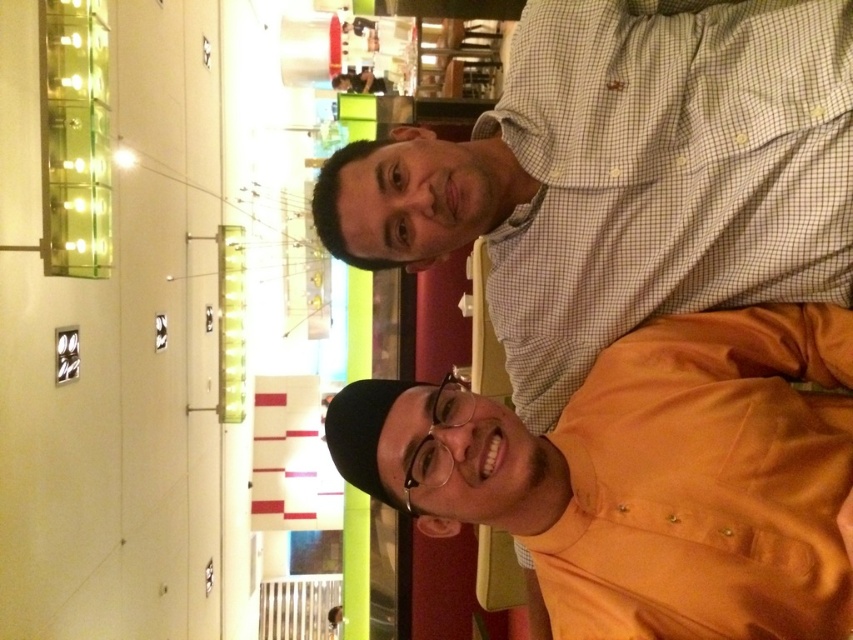
Question: Does orange satin shirt at upper right have a smaller size compared to white checkered shirt at upper right?

Choices:
 (A) yes
 (B) no

Answer: (A)

Question: Is orange satin shirt at upper right closer to the viewer compared to white checkered shirt at upper right?

Choices:
 (A) no
 (B) yes

Answer: (B)

Question: Can you confirm if orange satin shirt at upper right is wider than white checkered shirt at upper right?

Choices:
 (A) yes
 (B) no

Answer: (A)

Question: Which point is closer to the camera?

Choices:
 (A) white checkered shirt at upper right
 (B) orange satin shirt at upper right

Answer: (B)

Question: Which point appears farthest from the camera in this image?

Choices:
 (A) click(688, 419)
 (B) click(782, 60)

Answer: (B)

Question: Which of the following is the farthest from the observer?

Choices:
 (A) orange satin shirt at upper right
 (B) white checkered shirt at upper right

Answer: (B)